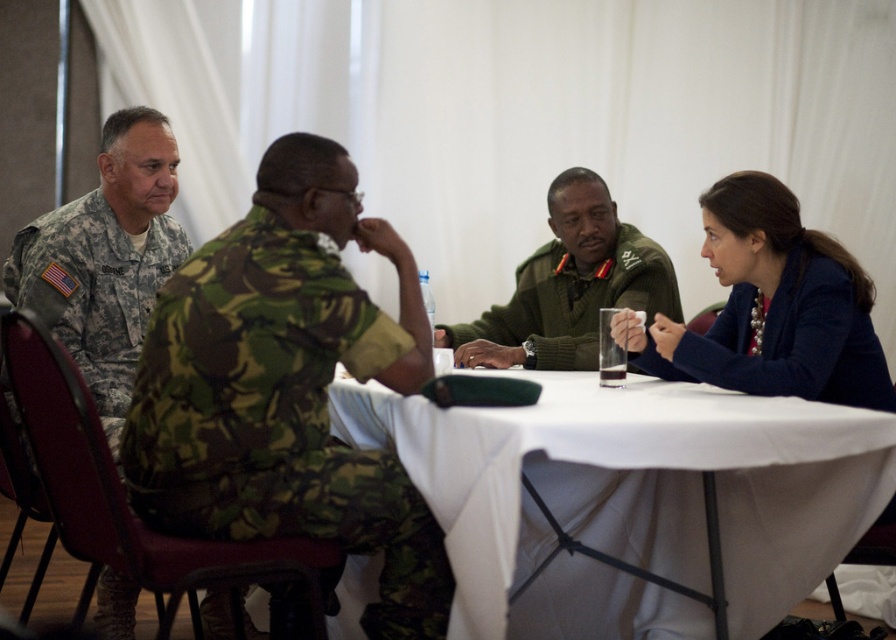
You are a GUI agent. You are given a task and a screenshot of the screen. Output one action in this format:
    pyautogui.click(x=<x>, y=<y>)
    Task: Click on the blue fabric jacket at upper right
    The height and width of the screenshot is (640, 896).
    Given the screenshot: What is the action you would take?
    pyautogui.click(x=774, y=307)

Can you confirm if blue fabric jacket at upper right is shorter than camouflage uniform at left?

Correct, blue fabric jacket at upper right is not as tall as camouflage uniform at left.

This screenshot has height=640, width=896. In order to click on blue fabric jacket at upper right in this screenshot , I will do `click(774, 307)`.

Does camouflage fabric uniform at center appear over green wool sweater at center?

No, camouflage fabric uniform at center is not above green wool sweater at center.

This screenshot has height=640, width=896. In order to click on camouflage fabric uniform at center in this screenshot , I will do `click(277, 413)`.

In order to click on camouflage fabric uniform at center in this screenshot , I will do `click(277, 413)`.

The image size is (896, 640). What do you see at coordinates (277, 413) in the screenshot? I see `camouflage fabric uniform at center` at bounding box center [277, 413].

Can you confirm if camouflage fabric uniform at center is positioned to the left of white cloth table at center?

Correct, you'll find camouflage fabric uniform at center to the left of white cloth table at center.

Between point (168, 392) and point (481, 634), which one is positioned in front?

Point (481, 634)

I want to click on camouflage fabric uniform at center, so click(x=277, y=413).